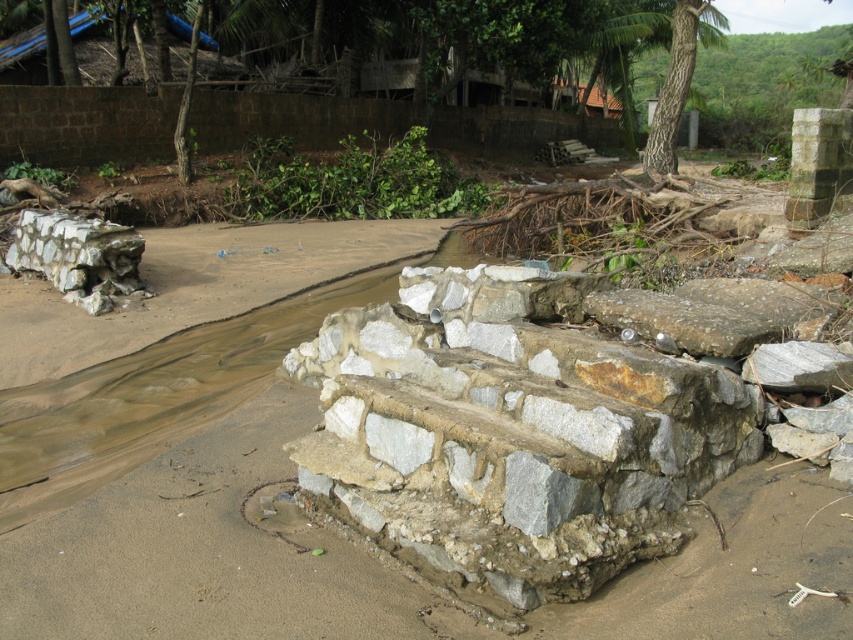
Does gray stone steps at center have a greater width compared to brown sandy dirt track at center?

Indeed, gray stone steps at center has a greater width compared to brown sandy dirt track at center.

Is point (540, 538) behind point (851, 552)?

Yes, it is behind point (851, 552).

At what (x,y) coordinates should I click in order to perform the action: click on gray stone steps at center. Please return your answer as a coordinate pair (x, y). This screenshot has width=853, height=640. Looking at the image, I should click on (514, 432).

Measure the distance between gray stone steps at center and gray stone wall at left.

A distance of 4.81 meters exists between gray stone steps at center and gray stone wall at left.

Between point (512, 602) and point (57, 237), which one is positioned in front?

Point (512, 602)

Find the location of a particular element. Image resolution: width=853 pixels, height=640 pixels. gray stone steps at center is located at coordinates (514, 432).

Can you confirm if brown sandy dirt track at center is shorter than gray stone wall at left?

Indeed, brown sandy dirt track at center has a lesser height compared to gray stone wall at left.

Is point (711, 529) less distant than point (84, 243)?

Yes, point (711, 529) is in front of point (84, 243).

Which is behind, point (663, 588) or point (30, 228)?

Positioned behind is point (30, 228).

Locate an element on the screen. This screenshot has width=853, height=640. brown sandy dirt track at center is located at coordinates (206, 552).